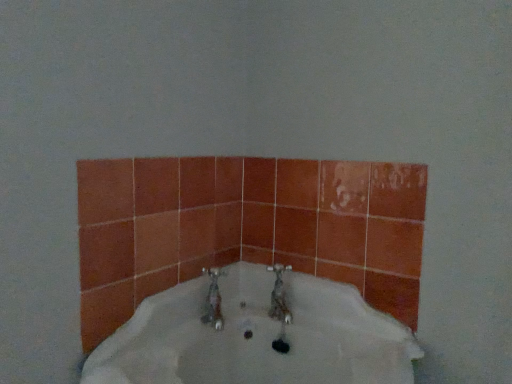
Describe the element at coordinates (256, 337) in the screenshot. The height and width of the screenshot is (384, 512). I see `white glossy bathtub at center` at that location.

The height and width of the screenshot is (384, 512). I want to click on white glossy bathtub at center, so click(x=256, y=337).

Where is `white glossy bathtub at center`? white glossy bathtub at center is located at coordinates (256, 337).